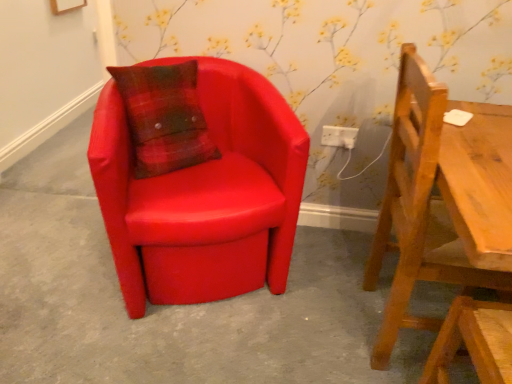
Locate an element on the screen. The image size is (512, 384). white plastic electric outlet at center is located at coordinates (339, 136).

Where is `matte leather chair at left, the second chair viewed from the right`? This screenshot has height=384, width=512. matte leather chair at left, the second chair viewed from the right is located at coordinates (204, 194).

How different are the orientations of matte red chair at center and wooden chair at right, the second chair from the left, in degrees?

There is a 0.185-degree angle between the facing directions of matte red chair at center and wooden chair at right, the second chair from the left.

Considering the sizes of objects matte red chair at center and wooden chair at right, the second chair from the left, in the image provided, who is wider, matte red chair at center or wooden chair at right, the second chair from the left,?

With larger width is matte red chair at center.

Does matte red chair at center turn towards wooden chair at right, which is counted as the first chair, starting from the right?

No, matte red chair at center is not facing towards wooden chair at right, which is counted as the first chair, starting from the right.

Considering the sizes of objects matte red chair at center and wooden chair at right, which is counted as the first chair, starting from the right, in the image provided, who is bigger, matte red chair at center or wooden chair at right, which is counted as the first chair, starting from the right,?

With larger size is wooden chair at right, which is counted as the first chair, starting from the right.

Who is shorter, white plastic electric outlet at center or wooden chair at right, which is counted as the first chair, starting from the right?

white plastic electric outlet at center.

How different are the orientations of white plastic electric outlet at center and wooden chair at right, which is counted as the first chair, starting from the right, in degrees?

There is a 88.9-degree angle between the facing directions of white plastic electric outlet at center and wooden chair at right, which is counted as the first chair, starting from the right.

From the image's perspective, which one is positioned lower, white plastic electric outlet at center or wooden chair at right, which is counted as the first chair, starting from the right?

wooden chair at right, which is counted as the first chair, starting from the right, from the image's perspective.

How far apart are white plastic electric outlet at center and wooden chair at right, which is counted as the first chair, starting from the right?

They are 25.43 inches apart.

Considering the points (150, 188) and (414, 257), which point is behind, point (150, 188) or point (414, 257)?

The point (150, 188) is behind.

Is matte leather chair at left, acting as the 1th chair starting from the left, inside or outside of wooden chair at right, the second chair from the left?

matte leather chair at left, acting as the 1th chair starting from the left, is spatially situated outside wooden chair at right, the second chair from the left.

Measure the distance from matte leather chair at left, the second chair viewed from the right, to wooden chair at right, which is counted as the first chair, starting from the right.

matte leather chair at left, the second chair viewed from the right, and wooden chair at right, which is counted as the first chair, starting from the right, are 20.21 inches apart from each other.

Would you say matte red chair at center is part of white plastic electric outlet at center's contents?

Actually, matte red chair at center is outside white plastic electric outlet at center.

Considering the positions of objects white plastic electric outlet at center and matte red chair at center in the image provided, who is more to the left, white plastic electric outlet at center or matte red chair at center?

matte red chair at center is more to the left.

Which of these two, white plastic electric outlet at center or matte red chair at center, is smaller?

Smaller between the two is white plastic electric outlet at center.

Can you tell me how much wooden chair at right, which is counted as the first chair, starting from the right, and white plastic electric outlet at center differ in facing direction?

88.9 degrees separate the facing orientations of wooden chair at right, which is counted as the first chair, starting from the right, and white plastic electric outlet at center.

In the image, is wooden chair at right, the second chair from the left, positioned in front of or behind white plastic electric outlet at center?

Visually, wooden chair at right, the second chair from the left, is located in front of white plastic electric outlet at center.

Is wooden chair at right, which is counted as the first chair, starting from the right, not within white plastic electric outlet at center?

Yes, wooden chair at right, which is counted as the first chair, starting from the right, is outside of white plastic electric outlet at center.

From the picture: From the image's perspective, is wooden chair at right, the second chair from the left, on white plastic electric outlet at center?

Incorrect, from the image's perspective, wooden chair at right, the second chair from the left, is lower than white plastic electric outlet at center.

Which point is more distant from viewer, (405,239) or (202,357)?

Point (202,357)

Which of these two, wooden chair at right, the second chair from the left, or matte red chair at center, is bigger?

Bigger between the two is wooden chair at right, the second chair from the left.

Can you tell me how much wooden chair at right, which is counted as the first chair, starting from the right, and matte red chair at center differ in facing direction?

The angle between the facing direction of wooden chair at right, which is counted as the first chair, starting from the right, and the facing direction of matte red chair at center is 0.185 degrees.

Looking at this image, from the image's perspective, which is below, wooden chair at right, the second chair from the left, or matte red chair at center?

matte red chair at center is shown below in the image.

Can you see wooden chair at right, the second chair from the left, touching matte leather chair at left, the second chair viewed from the right?

No, wooden chair at right, the second chair from the left, is not making contact with matte leather chair at left, the second chair viewed from the right.

From a real-world perspective, between wooden chair at right, the second chair from the left, and matte leather chair at left, the second chair viewed from the right, who is vertically higher?

From a 3D spatial view, wooden chair at right, the second chair from the left, is above.

Considering the relative sizes of wooden chair at right, which is counted as the first chair, starting from the right, and matte leather chair at left, the second chair viewed from the right, in the image provided, is wooden chair at right, which is counted as the first chair, starting from the right, wider than matte leather chair at left, the second chair viewed from the right,?

Incorrect, the width of wooden chair at right, which is counted as the first chair, starting from the right, does not surpass that of matte leather chair at left, the second chair viewed from the right.

From a real-world perspective, starting from the matte red chair at center, which chair is the 2nd one vertically above it? Please provide its 2D coordinates.

[(432, 199)]

Identify the location of electric outlet on the left side of wooden chair at right, the second chair from the left. (339, 136).

From the image, which object appears to be nearer to matte leather chair at left, the second chair viewed from the right, wooden chair at right, which is counted as the first chair, starting from the right, or white plastic electric outlet at center?

wooden chair at right, which is counted as the first chair, starting from the right, lies closer to matte leather chair at left, the second chair viewed from the right, than the other object.

Looking at the image, which one is located further to matte red chair at center, matte leather chair at left, acting as the 1th chair starting from the left, or wooden chair at right, the second chair from the left?

The object further to matte red chair at center is wooden chair at right, the second chair from the left.

Which object lies nearer to the anchor point wooden chair at right, the second chair from the left, white plastic electric outlet at center or matte leather chair at left, the second chair viewed from the right?

matte leather chair at left, the second chair viewed from the right, is closer to wooden chair at right, the second chair from the left.

From the image, which object appears to be nearer to white plastic electric outlet at center, matte red chair at center or matte leather chair at left, acting as the 1th chair starting from the left?

matte leather chair at left, acting as the 1th chair starting from the left.

Based on their spatial positions, is white plastic electric outlet at center or wooden chair at right, the second chair from the left, further from matte red chair at center?

Among the two, white plastic electric outlet at center is located further to matte red chair at center.

Estimate the real-world distances between objects in this image. Which object is closer to white plastic electric outlet at center, matte red chair at center or wooden chair at right, the second chair from the left?

Based on the image, wooden chair at right, the second chair from the left, appears to be nearer to white plastic electric outlet at center.

Based on their spatial positions, is matte red chair at center or white plastic electric outlet at center closer to matte leather chair at left, acting as the 1th chair starting from the left?

matte red chair at center is closer to matte leather chair at left, acting as the 1th chair starting from the left.

Which object lies nearer to the anchor point matte red chair at center, white plastic electric outlet at center or matte leather chair at left, the second chair viewed from the right?

matte leather chair at left, the second chair viewed from the right, is positioned closer to the anchor matte red chair at center.

What are the coordinates of `electric outlet between matte red chair at center and wooden chair at right, the second chair from the left` in the screenshot? It's located at (339, 136).

I want to click on chair between matte red chair at center and wooden chair at right, the second chair from the left, from left to right, so click(x=204, y=194).

Image resolution: width=512 pixels, height=384 pixels. I want to click on chair positioned between wooden chair at right, the second chair from the left, and white plastic electric outlet at center from near to far, so click(x=204, y=194).

Locate an element on the screen. Image resolution: width=512 pixels, height=384 pixels. concrete located between matte leather chair at left, acting as the 1th chair starting from the left, and white plastic electric outlet at center in the depth direction is located at coordinates (183, 312).